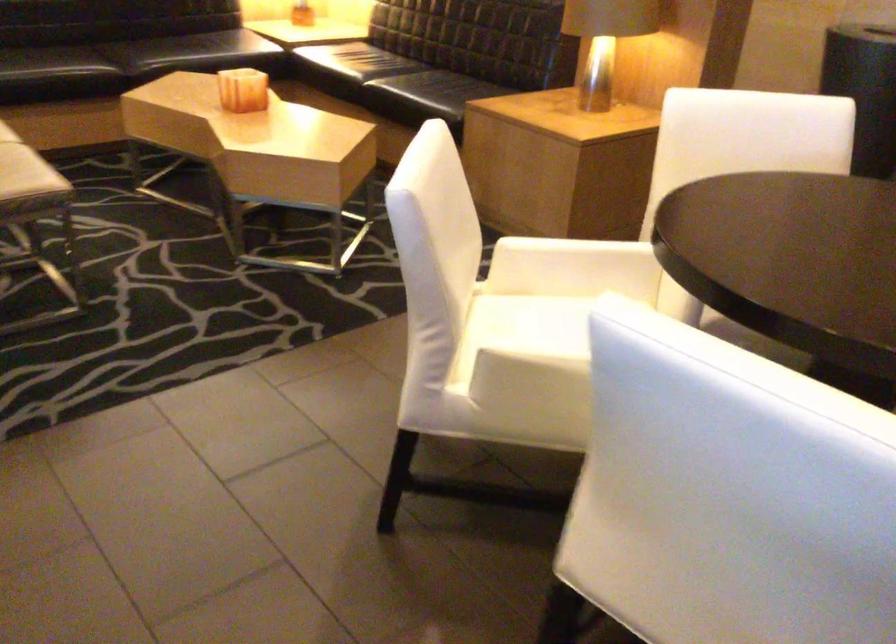
Identify the location of black sofa sitting surface. The width and height of the screenshot is (896, 644). (444, 57).